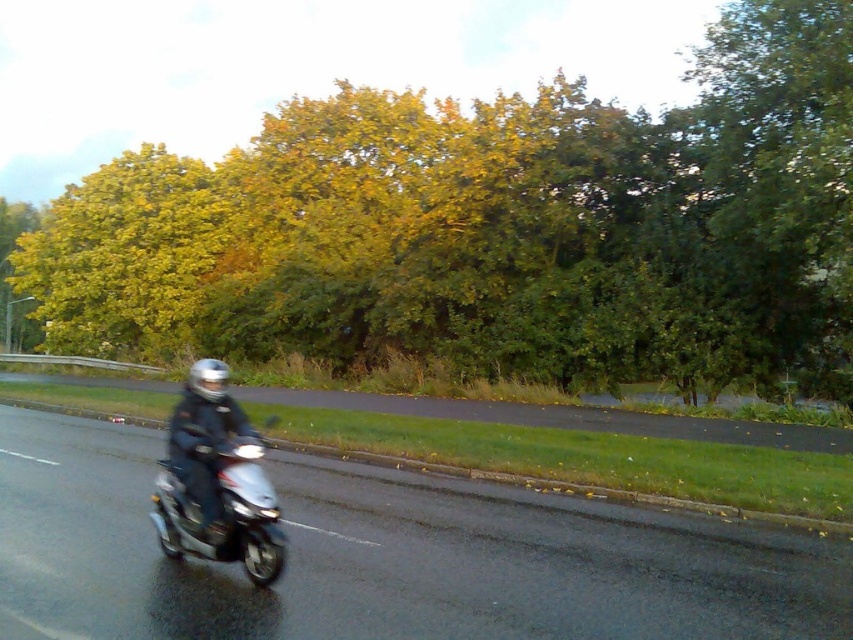
Question: Can you confirm if yellow-green foliage at center is bigger than shiny silver scooter at center?

Choices:
 (A) yes
 (B) no

Answer: (A)

Question: Estimate the real-world distances between objects in this image. Which object is farther from the shiny silver scooter at center?

Choices:
 (A) yellow-green foliage at center
 (B) metallic silver scooter at center
 (C) black leather jacket at center

Answer: (A)

Question: Can you confirm if yellow-green foliage at center is thinner than metallic silver scooter at center?

Choices:
 (A) no
 (B) yes

Answer: (A)

Question: In this image, where is shiny silver scooter at center located relative to black leather jacket at center?

Choices:
 (A) above
 (B) below

Answer: (A)

Question: Which of the following is the closest to the observer?

Choices:
 (A) shiny silver scooter at center
 (B) black leather jacket at center
 (C) metallic silver scooter at center
 (D) yellow-green foliage at center

Answer: (C)

Question: Which object is the farthest from the black leather jacket at center?

Choices:
 (A) yellow-green foliage at center
 (B) metallic silver scooter at center
 (C) shiny silver scooter at center

Answer: (A)